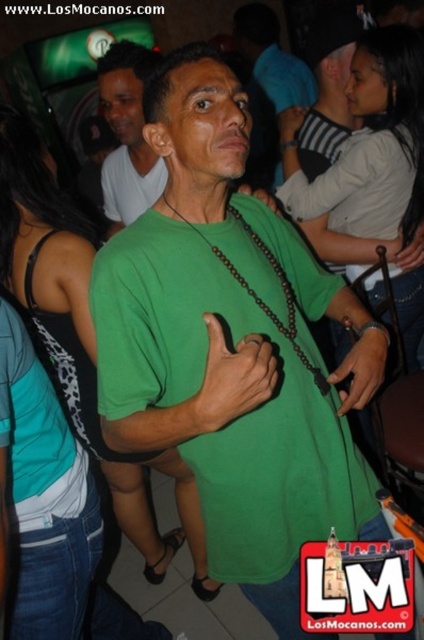
Question: Which of the following is the closest to the observer?

Choices:
 (A) matte black shirt at center
 (B) green matte shirt at center

Answer: (B)

Question: Is the position of green matte shirt at center less distant than that of matte black shirt at center?

Choices:
 (A) yes
 (B) no

Answer: (A)

Question: Which point is closer to the camera?

Choices:
 (A) (117, 68)
 (B) (162, 310)

Answer: (B)

Question: Is green matte shirt at center wider than matte black shirt at center?

Choices:
 (A) no
 (B) yes

Answer: (B)

Question: Is green matte shirt at center wider than matte black shirt at center?

Choices:
 (A) no
 (B) yes

Answer: (B)